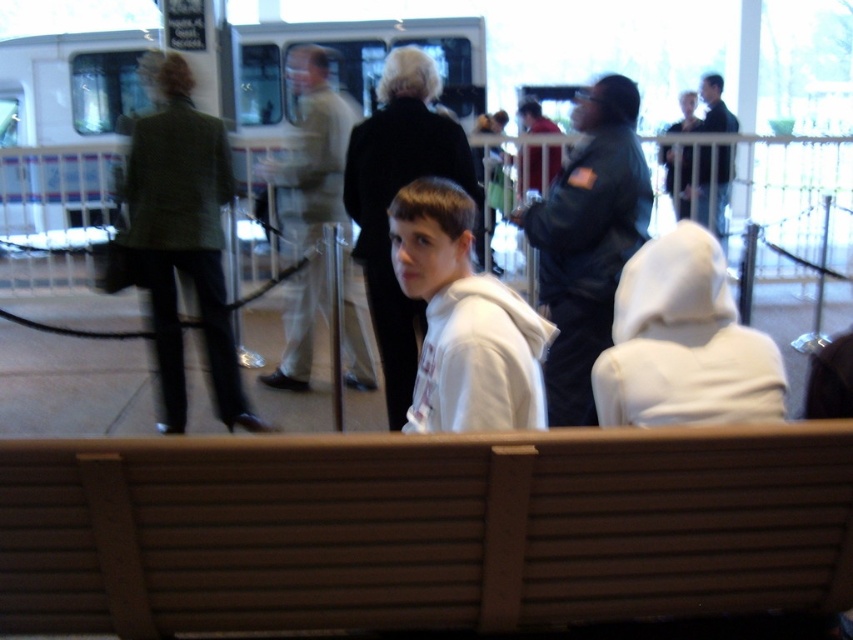
Does brown wood bench at center appear on the right side of white matte hoodie at center?

No, brown wood bench at center is not to the right of white matte hoodie at center.

The width and height of the screenshot is (853, 640). What do you see at coordinates (422, 529) in the screenshot?
I see `brown wood bench at center` at bounding box center [422, 529].

You are a GUI agent. You are given a task and a screenshot of the screen. Output one action in this format:
    pyautogui.click(x=<x>, y=<y>)
    Task: Click on the brown wood bench at center
    This screenshot has width=853, height=640.
    Given the screenshot: What is the action you would take?
    pos(422,529)

Who is higher up, brown wood bench at center or dark blue jacket at center?

dark blue jacket at center is higher up.

Which is behind, point (120, 464) or point (624, 224)?

The point (624, 224) is more distant.

Who is more distant from viewer, (791,513) or (570,154)?

The point (570,154) is behind.

Locate an element on the screen. The height and width of the screenshot is (640, 853). brown wood bench at center is located at coordinates (422, 529).

Who is more distant from viewer, (492, 392) or (577, 355)?

The point (577, 355) is behind.

The height and width of the screenshot is (640, 853). In order to click on white matte hoodie at center in this screenshot , I will do `click(463, 321)`.